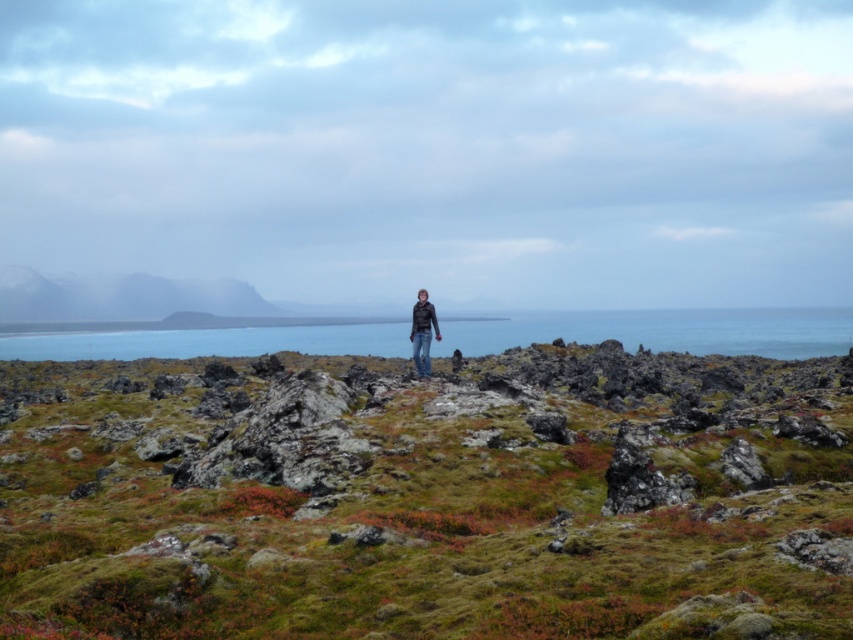
Which of these two, blue water at center or matte black jacket at center, stands taller?

Standing taller between the two is blue water at center.

This screenshot has width=853, height=640. I want to click on blue water at center, so click(x=662, y=330).

Who is lower down, green mossy hillside at center or matte black jacket at center?

Positioned lower is green mossy hillside at center.

Between green mossy hillside at center and matte black jacket at center, which one appears on the right side from the viewer's perspective?

From the viewer's perspective, matte black jacket at center appears more on the right side.

Who is more forward, (16,458) or (433,324)?

Point (16,458)

Where is `green mossy hillside at center`? green mossy hillside at center is located at coordinates (427, 497).

Which is in front, point (527, 570) or point (722, 346)?

Point (527, 570) is more forward.

Describe the element at coordinates (427, 497) in the screenshot. This screenshot has height=640, width=853. I see `green mossy hillside at center` at that location.

Image resolution: width=853 pixels, height=640 pixels. Find the location of `green mossy hillside at center`. green mossy hillside at center is located at coordinates (427, 497).